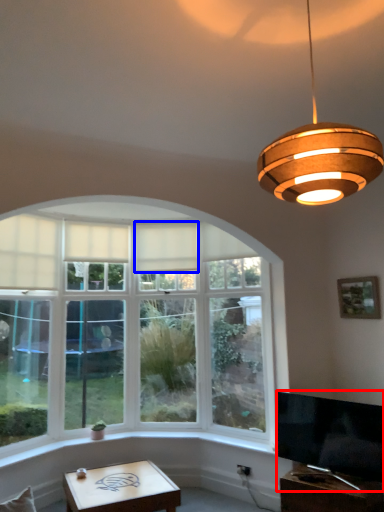
Question: Which of the following is the closest to the observer, television (highlighted by a red box) or curtain (highlighted by a blue box)?

Choices:
 (A) television
 (B) curtain

Answer: (A)